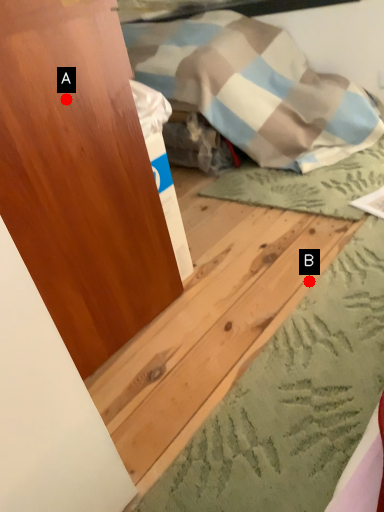
Question: Two points are circled on the image, labeled by A and B beside each circle. Among these points, which one is farthest from the camera?

Choices:
 (A) A is further
 (B) B is further

Answer: (B)